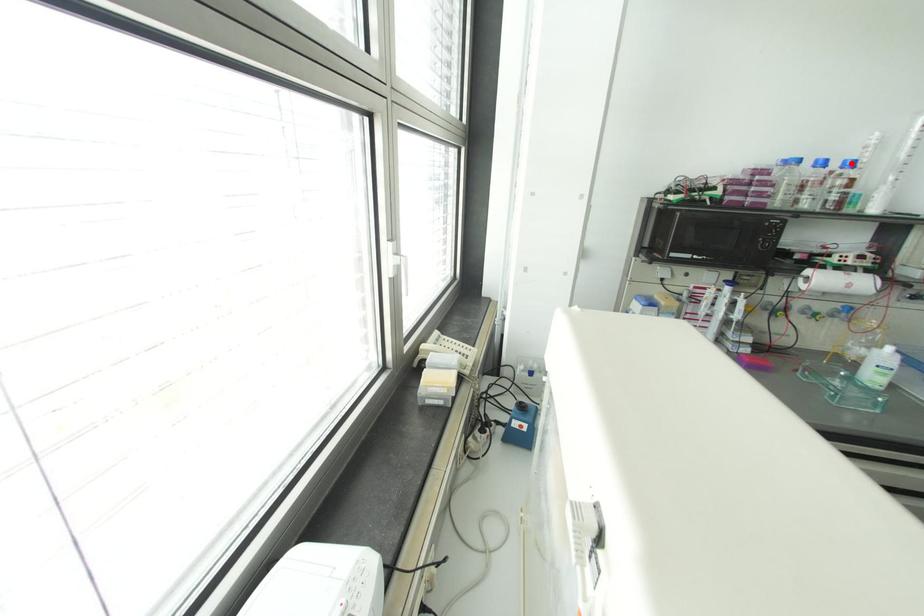
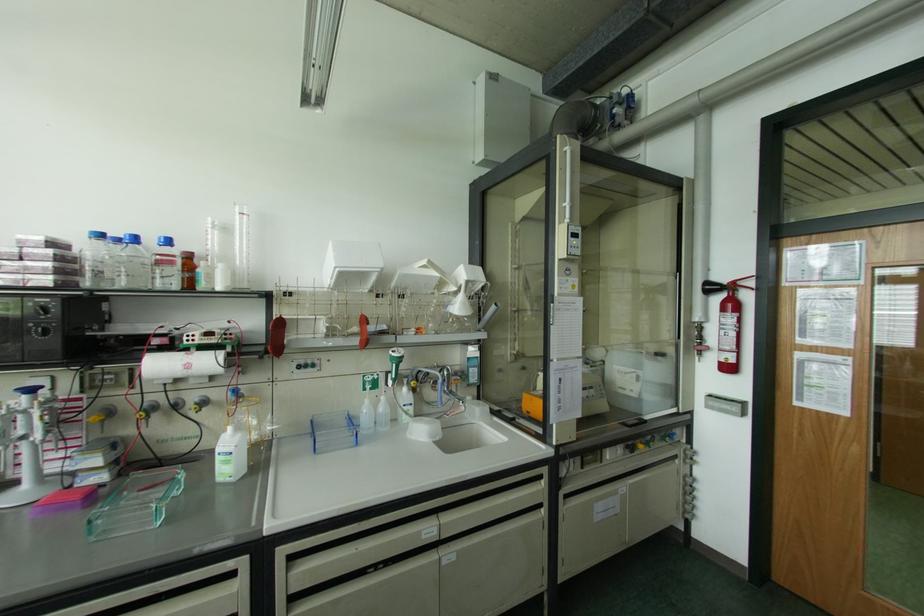
Question: I am providing you with two images of the same scene from different viewpoints. A red point is marked on the first image. Is the red point's position out of view in image 2?

Choices:
 (A) Yes
 (B) No

Answer: (B)